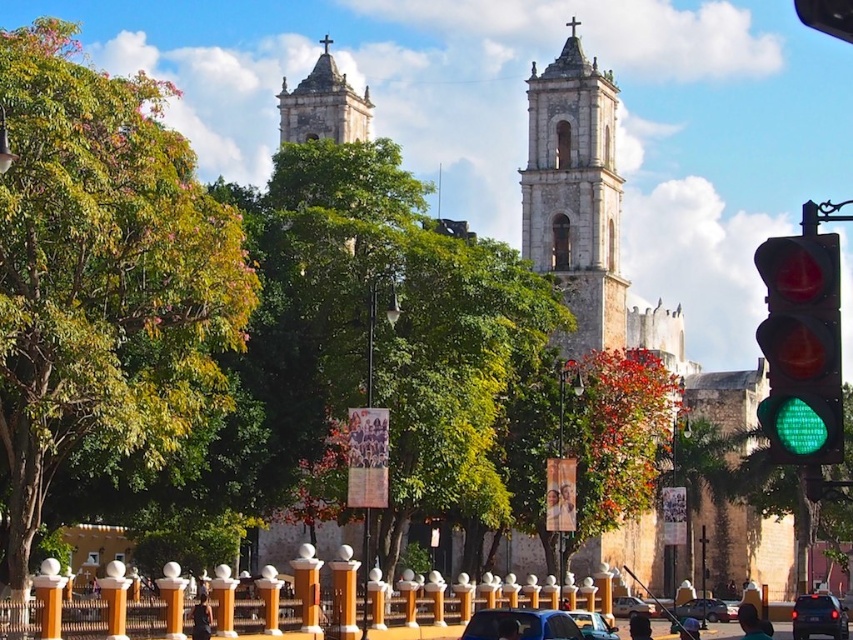
Question: Which object appears closest to the camera in this image?

Choices:
 (A) white stone tower at upper center
 (B) shiny black car at center

Answer: (B)

Question: Does white stone tower at upper center come in front of metallic blue car at center?

Choices:
 (A) yes
 (B) no

Answer: (B)

Question: Can you confirm if white stone tower at center is positioned above blue matte car at center?

Choices:
 (A) no
 (B) yes

Answer: (B)

Question: Can you confirm if white stone tower at upper center is thinner than white plastic car at lower center?

Choices:
 (A) yes
 (B) no

Answer: (B)

Question: Which point appears farthest from the camera in this image?

Choices:
 (A) (791, 275)
 (B) (624, 600)

Answer: (B)

Question: Which object is the closest to the green glass traffic light at right?

Choices:
 (A) shiny black sedan at lower right
 (B) metallic blue car at center

Answer: (B)